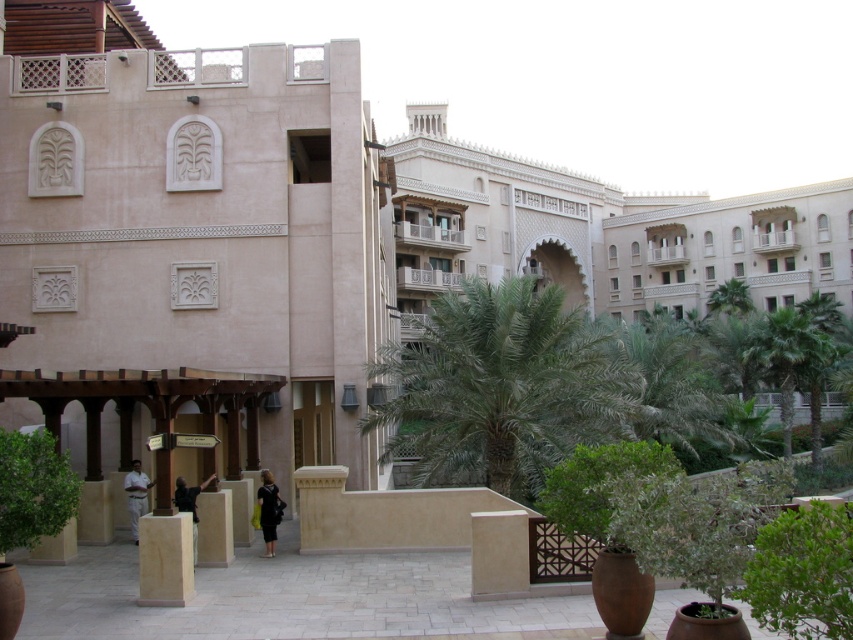
In order to click on matte beige building at center in this screenshot , I will do `click(189, 248)`.

Is matte beige building at center further to camera compared to green leafy palm tree at center?

No.

Between point (367, 477) and point (448, 396), which one is positioned in front?

Positioned in front is point (448, 396).

Where is `matte beige building at center`? matte beige building at center is located at coordinates (189, 248).

Who is positioned more to the right, matte beige building at center or green leafy bush at lower left?

green leafy bush at lower left

Can you confirm if matte beige building at center is smaller than green leafy bush at lower left?

Incorrect, matte beige building at center is not smaller in size than green leafy bush at lower left.

Is point (337, 358) in front of point (7, 444)?

No, (337, 358) is behind (7, 444).

What are the coordinates of `matte beige building at center` in the screenshot? It's located at (189, 248).

Which of these two, green leafy palm tree at center or green leafy bush at lower left, stands taller?

green leafy palm tree at center is taller.

Can you confirm if green leafy palm tree at center is positioned below green leafy bush at lower left?

Actually, green leafy palm tree at center is above green leafy bush at lower left.

Looking at this image, who is more distant from viewer, (605, 330) or (45, 449)?

The point (605, 330) is more distant.

I want to click on green leafy palm tree at center, so click(503, 387).